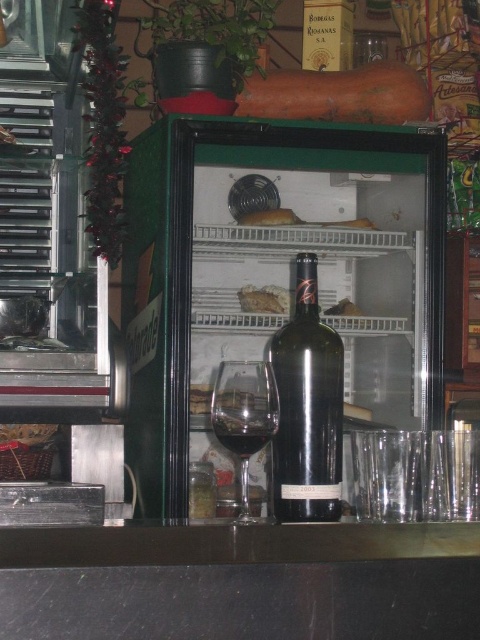
Find the location of a particular element. black granite counter at lower center is located at coordinates (240, 582).

Image resolution: width=480 pixels, height=640 pixels. What do you see at coordinates (240, 582) in the screenshot? I see `black granite counter at lower center` at bounding box center [240, 582].

This screenshot has width=480, height=640. I want to click on black granite counter at lower center, so click(x=240, y=582).

Is wooden log at upper center wider than transparent glass at center?

Correct, the width of wooden log at upper center exceeds that of transparent glass at center.

Can you confirm if wooden log at upper center is positioned to the right of transparent glass at center?

Yes, wooden log at upper center is to the right of transparent glass at center.

The width and height of the screenshot is (480, 640). Identify the location of wooden log at upper center. (337, 93).

This screenshot has width=480, height=640. I want to click on wooden log at upper center, so click(337, 93).

Can you confirm if black granite counter at lower center is positioned to the left of bread at center?

Correct, you'll find black granite counter at lower center to the left of bread at center.

This screenshot has height=640, width=480. What do you see at coordinates (240, 582) in the screenshot? I see `black granite counter at lower center` at bounding box center [240, 582].

The height and width of the screenshot is (640, 480). What are the coordinates of `black granite counter at lower center` in the screenshot? It's located at (240, 582).